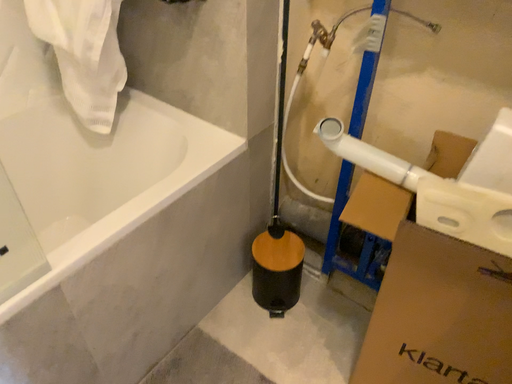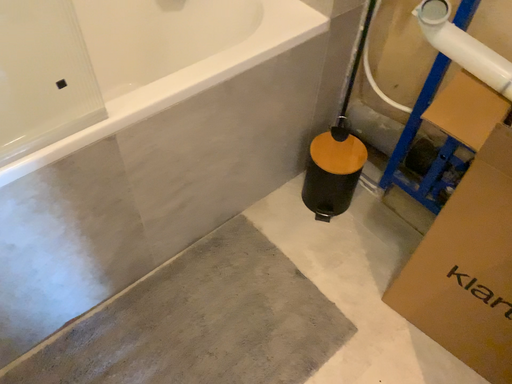
Question: How did the camera likely rotate when shooting the video?

Choices:
 (A) rotated left
 (B) rotated right

Answer: (A)